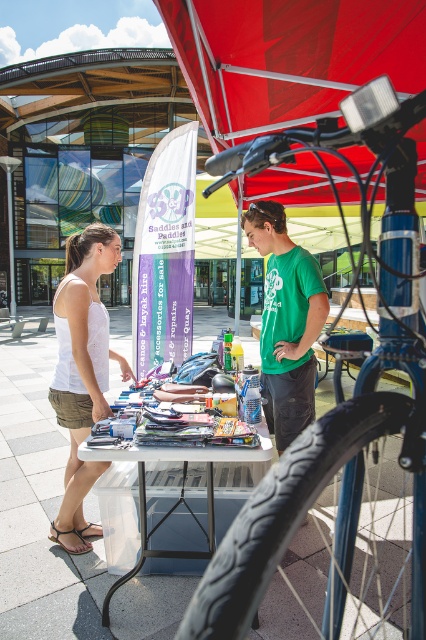
Which is in front, point (218, 140) or point (78, 296)?

Point (78, 296)

Is the position of red fabric canopy at upper center more distant than that of white fabric tank top at left?

No, it is in front of white fabric tank top at left.

What do you see at coordinates (288, 58) in the screenshot? Image resolution: width=426 pixels, height=640 pixels. I see `red fabric canopy at upper center` at bounding box center [288, 58].

This screenshot has width=426, height=640. What are the coordinates of `red fabric canopy at upper center` in the screenshot? It's located at (288, 58).

Does blue metallic bicycle at center have a smaller size compared to green cotton t-shirt at center?

No, blue metallic bicycle at center is not smaller than green cotton t-shirt at center.

Image resolution: width=426 pixels, height=640 pixels. Describe the element at coordinates (344, 452) in the screenshot. I see `blue metallic bicycle at center` at that location.

Identify the location of blue metallic bicycle at center. (344, 452).

Is red fabric canopy at upper center thinner than green cotton t-shirt at center?

Incorrect, red fabric canopy at upper center's width is not less than green cotton t-shirt at center's.

Which is above, red fabric canopy at upper center or green cotton t-shirt at center?

red fabric canopy at upper center

Identify the location of red fabric canopy at upper center. (288, 58).

In order to click on red fabric canopy at upper center in this screenshot , I will do `click(288, 58)`.